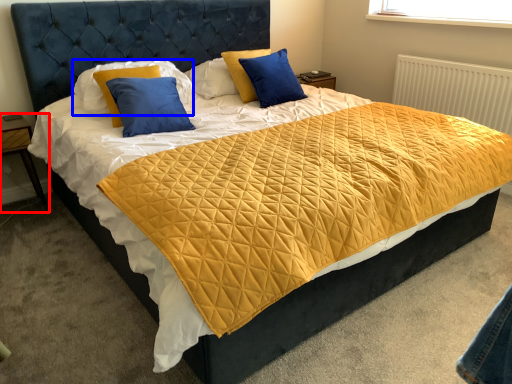
Question: Which of the following is the closest to the observer, nightstand (highlighted by a red box) or pillow (highlighted by a blue box)?

Choices:
 (A) nightstand
 (B) pillow

Answer: (B)